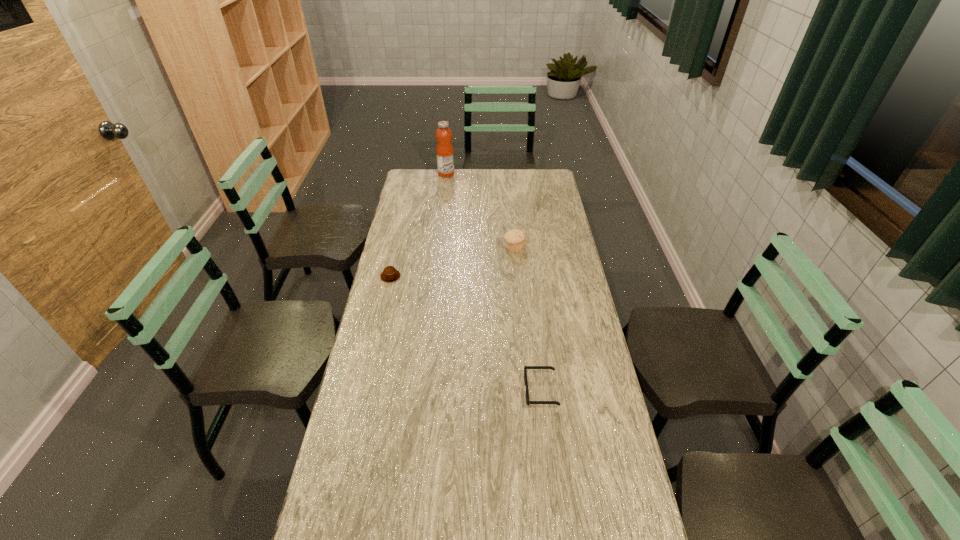
You are a GUI agent. You are given a task and a screenshot of the screen. Output one action in this format:
    pyautogui.click(x=<x>, y=<y>)
    Task: Click on the third object from right to left
    The image size is (960, 540).
    Given the screenshot: What is the action you would take?
    pyautogui.click(x=445, y=155)

Where is `the farthest object`? the farthest object is located at coordinates [x=445, y=155].

You are a GUI agent. You are given a task and a screenshot of the screen. Output one action in this format:
    pyautogui.click(x=<x>, y=<y>)
    Task: Click on the second farthest object
    
    Given the screenshot: What is the action you would take?
    pyautogui.click(x=515, y=239)

Locate an element on the screen. This screenshot has height=540, width=960. the right muffin is located at coordinates (515, 239).

Image resolution: width=960 pixels, height=540 pixels. What are the coordinates of `the third tallest object` in the screenshot? It's located at (390, 274).

Find the location of a particular element. the leftmost object is located at coordinates (390, 274).

Where is `the nearest object`? the nearest object is located at coordinates (528, 402).

I want to click on the shortest object, so click(x=528, y=402).

Find the location of a particular element. vacant space located on the front label of the tallest object is located at coordinates (476, 174).

At what (x,y) coordinates should I click in order to perform the action: click on vacant region located 0.170m on the left of the second farthest object. Please return your answer as a coordinate pair (x, y). Image resolution: width=960 pixels, height=540 pixels. Looking at the image, I should click on (465, 248).